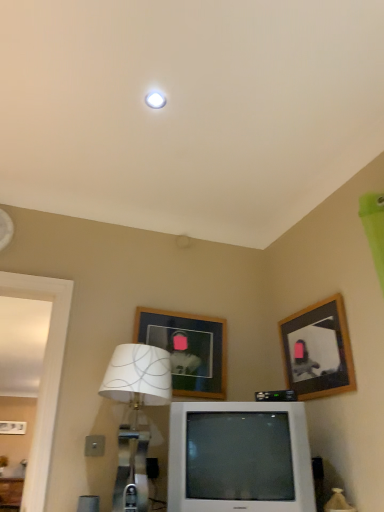
Question: In the image, is white plastic television at center on the left side or the right side of white fabric lampshade at lower center?

Choices:
 (A) right
 (B) left

Answer: (A)

Question: Is white plastic television at center in front of or behind white fabric lampshade at lower center in the image?

Choices:
 (A) front
 (B) behind

Answer: (B)

Question: Which object is positioned farthest from the wooden picture frame at upper right, which is counted as the second picture frame, starting from the left?

Choices:
 (A) white plastic television at center
 (B) white fabric lampshade at lower center
 (C) wooden picture frame at upper center, which appears as the 2th picture frame when viewed from the right

Answer: (B)

Question: Which of these objects is positioned closest to the white plastic television at center?

Choices:
 (A) wooden picture frame at upper right, which is counted as the second picture frame, starting from the left
 (B) white fabric lampshade at lower center
 (C) wooden picture frame at upper center, which appears as the 2th picture frame when viewed from the right

Answer: (B)